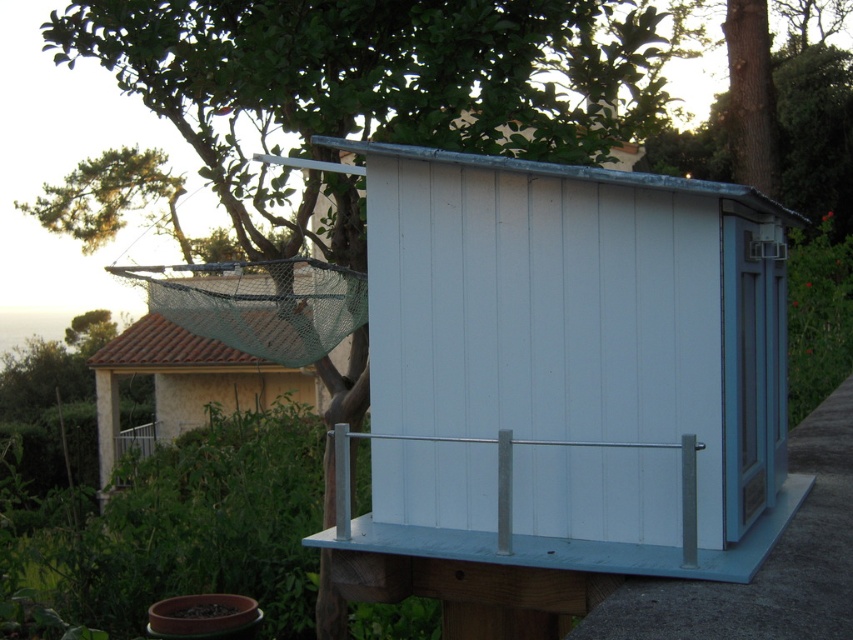
Question: Is white wood shed at center closer to camera compared to silver metallic rail at center?

Choices:
 (A) yes
 (B) no

Answer: (A)

Question: Is white wood shed at center bigger than green mesh net at upper left?

Choices:
 (A) no
 (B) yes

Answer: (B)

Question: Is green mesh net at upper left bigger than silver metallic rail at center?

Choices:
 (A) yes
 (B) no

Answer: (B)

Question: Among these points, which one is farthest from the camera?

Choices:
 (A) (183, 396)
 (B) (338, 474)
 (C) (525, 163)

Answer: (A)

Question: Which point is farther to the camera?

Choices:
 (A) silver metallic rail at center
 (B) white wood shed at center
 (C) green mesh net at upper left

Answer: (C)

Question: Which point is closer to the camera?

Choices:
 (A) white wood shed at center
 (B) silver metallic rail at center

Answer: (A)